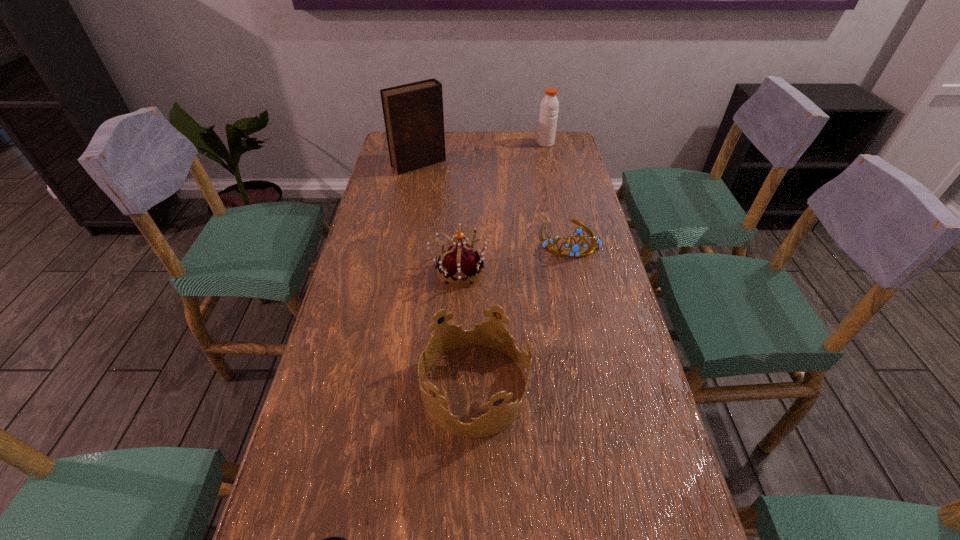
Image resolution: width=960 pixels, height=540 pixels. In order to click on Bible in this screenshot , I will do [x=413, y=113].

Locate an element on the screen. Image resolution: width=960 pixels, height=540 pixels. the second farthest object is located at coordinates (413, 113).

This screenshot has height=540, width=960. Find the location of `the second tallest object`. the second tallest object is located at coordinates (549, 107).

Locate an element on the screen. shaker is located at coordinates (549, 107).

Locate an element on the screen. Image resolution: width=960 pixels, height=540 pixels. the second nearest object is located at coordinates (492, 333).

Identify the location of the rightmost tiara. The height and width of the screenshot is (540, 960). (575, 248).

Find the location of `the shortest tiara`. the shortest tiara is located at coordinates (575, 248).

At what (x,y) coordinates should I click in order to perform the action: click on vacant region located 0.140m on the back of the second farthest object. Please return your answer as a coordinate pair (x, y). Looking at the image, I should click on (424, 136).

This screenshot has height=540, width=960. What are the coordinates of `blank space located 0.320m on the front of the shaker` in the screenshot? It's located at (557, 194).

Image resolution: width=960 pixels, height=540 pixels. I want to click on vacant area situated on the front-facing side of the nearest tiara, so click(x=567, y=387).